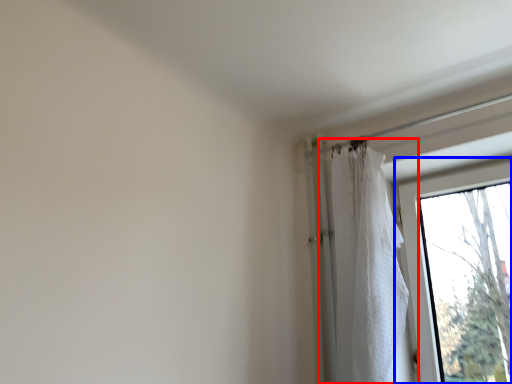
Question: Which object is closer to the camera taking this photo, curtain (highlighted by a red box) or window (highlighted by a blue box)?

Choices:
 (A) curtain
 (B) window

Answer: (A)